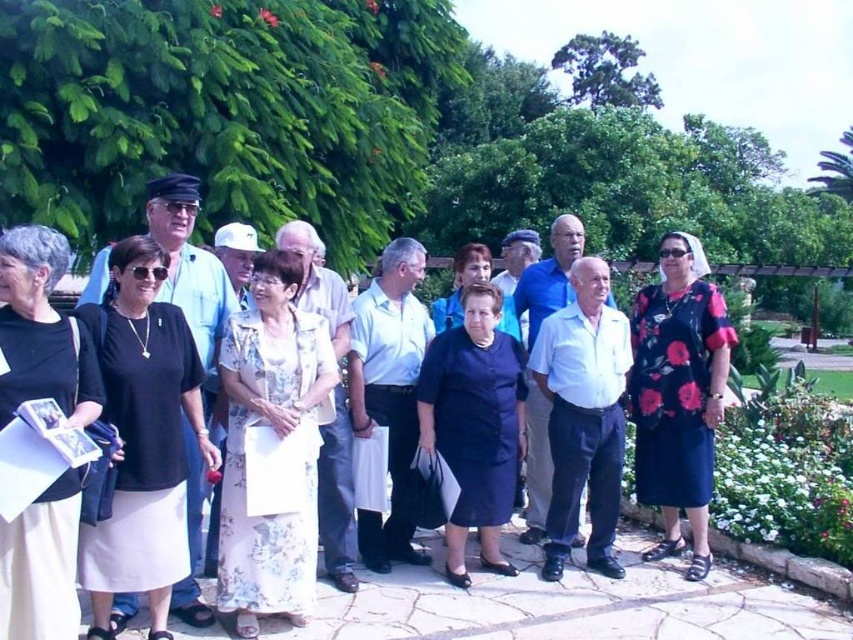
You are standing in the park and see two points marked in the image. Which point, point (183, 406) or point (688, 486), is closer to you?

Point (183, 406) is closer to the viewer than point (688, 486).

You are a photographer at the park and see the black matte dress at center and the floral fabric dress at center. Which one is more to the left?

The black matte dress at center is positioned on the left side of the floral fabric dress at center, so it is more to the left.